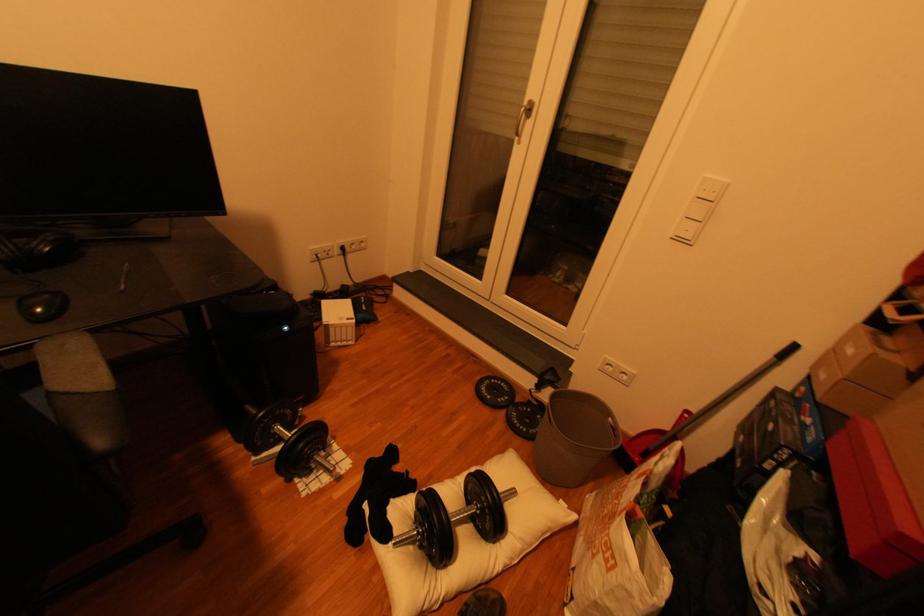
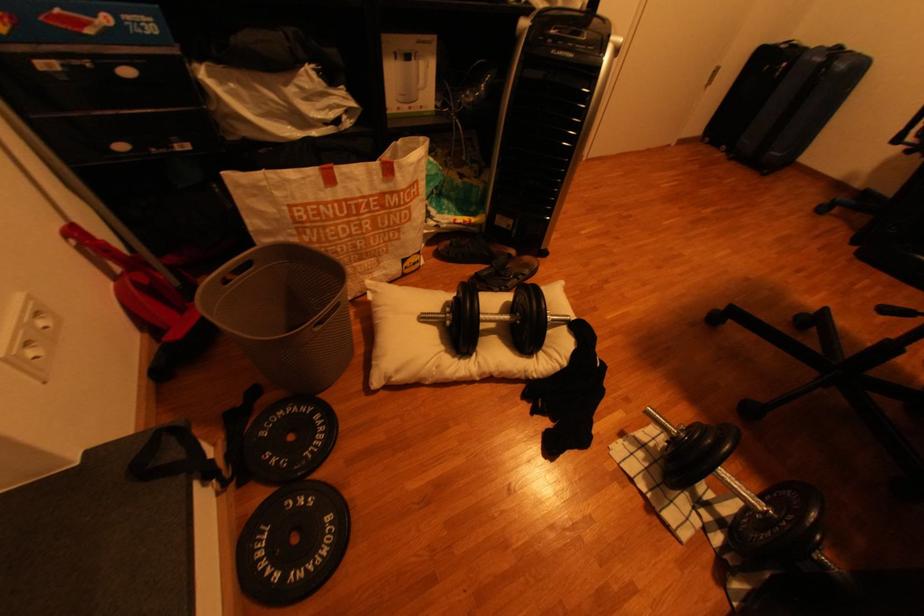
Where in the second image is the point corresponding to the point at 326,472 from the first image?

(665, 446)